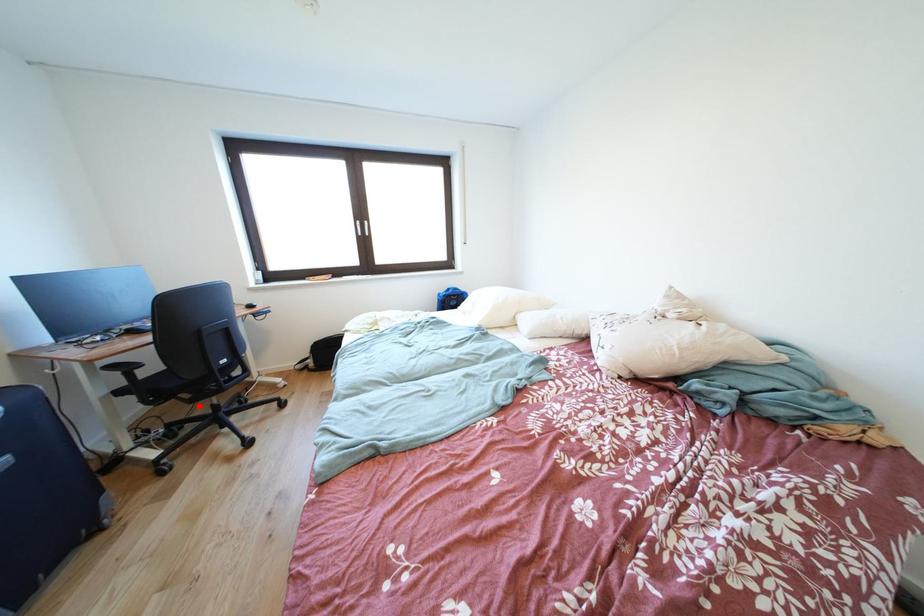
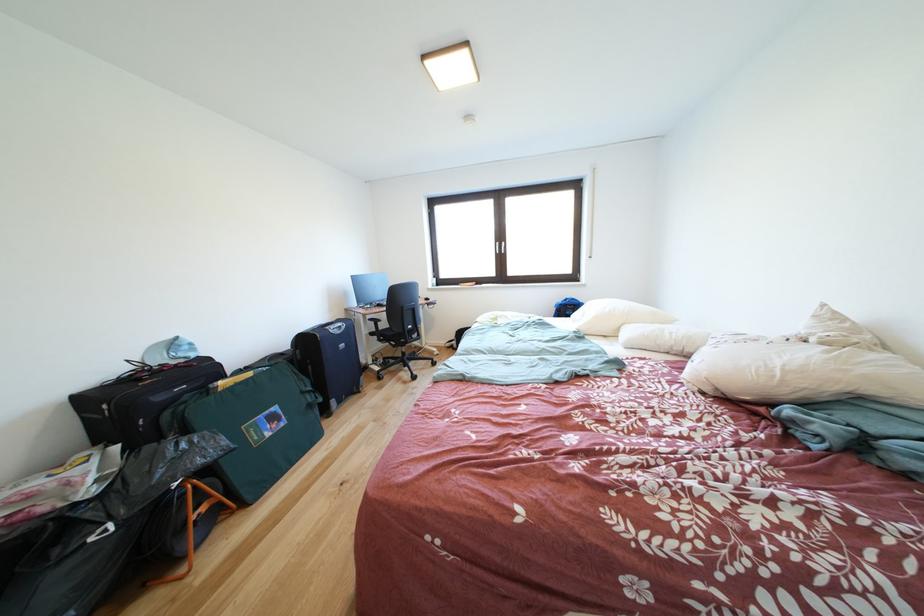
In the second image, find the point that corresponds to the highlighted location in the first image.

(403, 351)